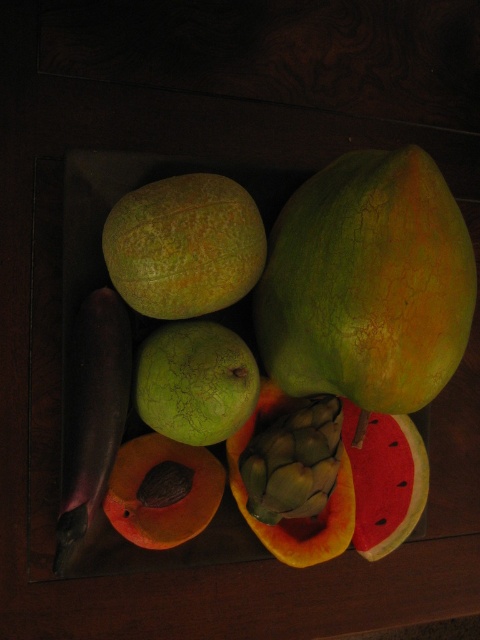
You are a delivery person who needs to place a small package between the green cracked melon at center and the watermelon at lower right. The package is 10 inches long. Is there enough space between them to fit the package?

The distance between the green cracked melon at center and the watermelon at lower right is 9.08 inches. Since the package is 10 inches long, it cannot fit in the space between them as the package is longer than the available distance.

You are arranging fruits on a shelf and need to stack the green cracked melon at center and the smooth orange papaya at center vertically. Which fruit should go on the bottom to ensure stability?

The green cracked melon at center should go on the bottom because it is taller than the smooth orange papaya at center, providing a stable base.